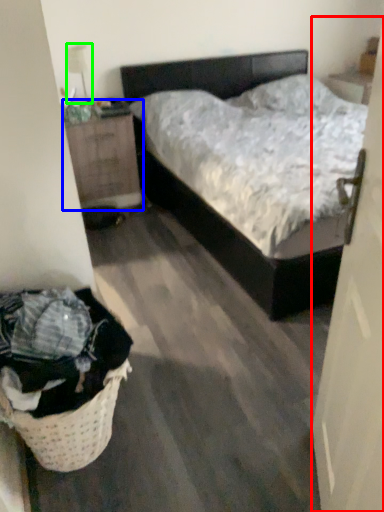
Question: Considering the real-world distances, which object is closest to door (highlighted by a red box)? nightstand (highlighted by a blue box) or lamp (highlighted by a green box).

Choices:
 (A) nightstand
 (B) lamp

Answer: (A)